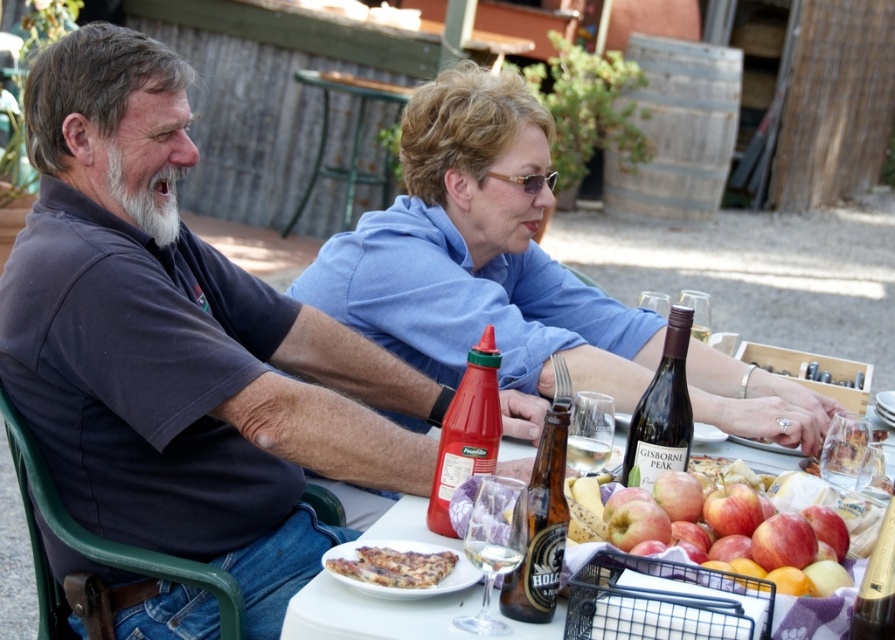
Is matte black shirt at center to the right of golden crispy pizza at center from the viewer's perspective?

Incorrect, matte black shirt at center is not on the right side of golden crispy pizza at center.

Does matte black shirt at center have a smaller size compared to golden crispy pizza at center?

Actually, matte black shirt at center might be larger than golden crispy pizza at center.

What are the coordinates of `matte black shirt at center` in the screenshot? It's located at (180, 344).

Does matte glass wine bottle at center have a greater height compared to golden crispy pizza at center?

Correct, matte glass wine bottle at center is much taller as golden crispy pizza at center.

Can you confirm if matte glass wine bottle at center is thinner than golden crispy pizza at center?

Indeed, matte glass wine bottle at center has a lesser width compared to golden crispy pizza at center.

Is point (666, 419) in front of point (403, 552)?

No.

In order to click on matte glass wine bottle at center in this screenshot , I will do `click(662, 412)`.

Between white plastic basket at center and golden crispy pizza at center, which one is positioned lower?

golden crispy pizza at center

Describe the element at coordinates (371, 614) in the screenshot. The width and height of the screenshot is (895, 640). I see `white plastic basket at center` at that location.

In order to click on white plastic basket at center in this screenshot , I will do `click(371, 614)`.